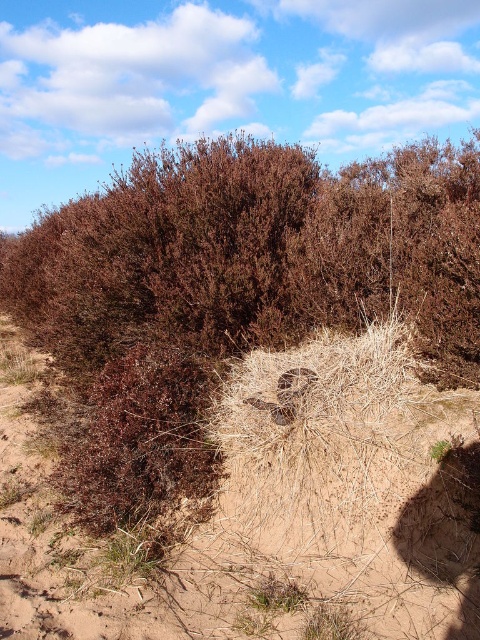
Question: Which object is closer to the camera taking this photo?

Choices:
 (A) dry straw nest at center
 (B) brown dry bush at center

Answer: (A)

Question: Is brown dry bush at center thinner than dry straw nest at center?

Choices:
 (A) yes
 (B) no

Answer: (B)

Question: Among these objects, which one is nearest to the camera?

Choices:
 (A) dry straw nest at center
 (B) brown dry bush at center

Answer: (A)

Question: Is brown dry bush at center smaller than dry straw nest at center?

Choices:
 (A) no
 (B) yes

Answer: (A)

Question: Which point appears closest to the camera in this image?

Choices:
 (A) (470, 522)
 (B) (55, 241)

Answer: (A)

Question: Is brown dry bush at center wider than dry straw nest at center?

Choices:
 (A) yes
 (B) no

Answer: (A)